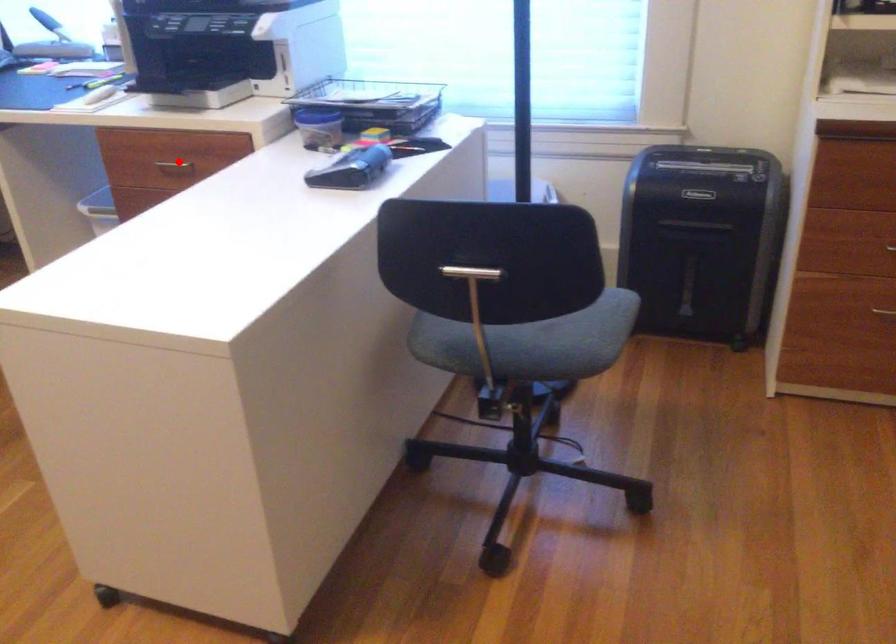
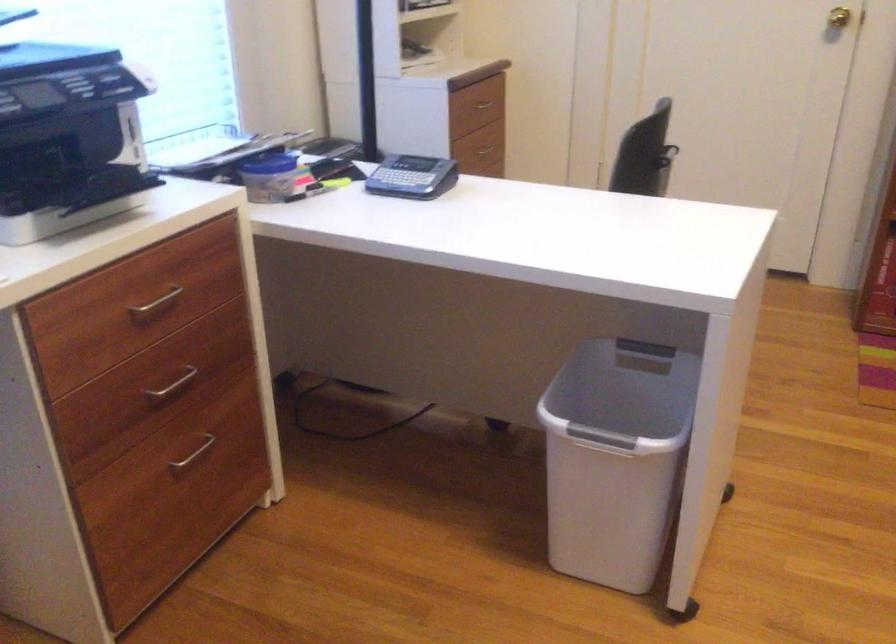
Where in the second image is the point corresponding to the highlighted location from the first image?

(156, 303)